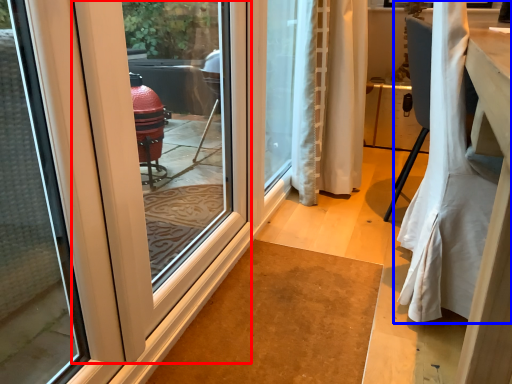
Question: Which object appears closest to the camera in this image, door (highlighted by a red box) or curtain (highlighted by a blue box)?

Choices:
 (A) door
 (B) curtain

Answer: (A)